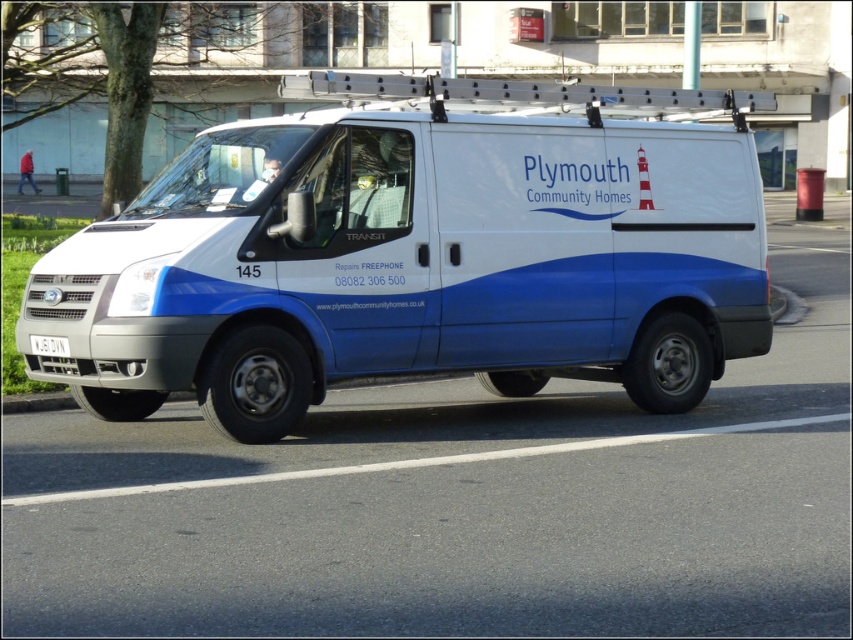
Question: Which point is farther to the camera?

Choices:
 (A) (62, 337)
 (B) (206, 358)

Answer: (A)

Question: Does white matte van at center have a smaller size compared to white plastic license plate at center?

Choices:
 (A) no
 (B) yes

Answer: (A)

Question: Does white matte van at center come behind white plastic license plate at center?

Choices:
 (A) no
 (B) yes

Answer: (A)

Question: Which point is closer to the camera taking this photo?

Choices:
 (A) (676, 92)
 (B) (41, 339)

Answer: (B)

Question: In this image, where is white matte van at center located relative to white plastic license plate at center?

Choices:
 (A) above
 (B) below

Answer: (A)